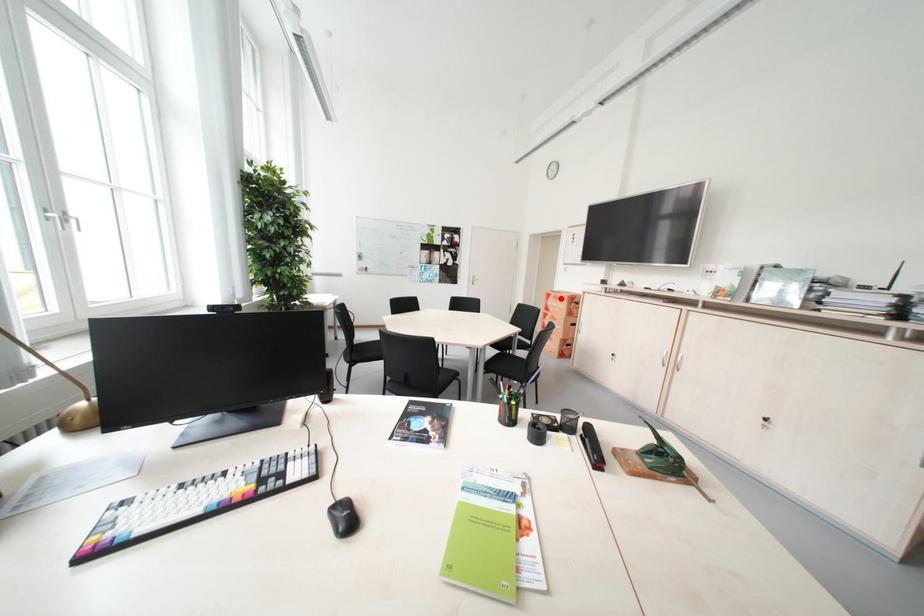
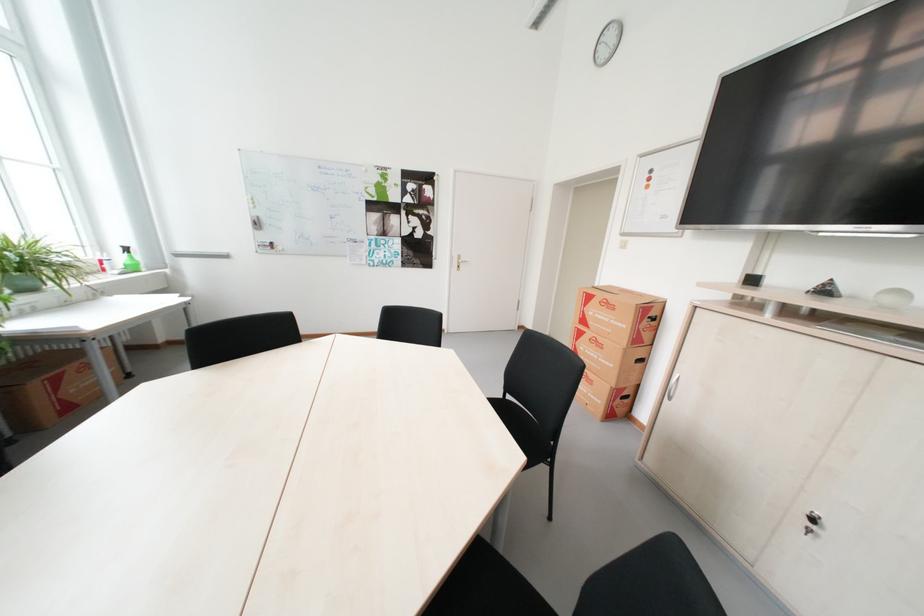
Question: I am providing you with two images of the same scene from different viewpoints. Image1 has a red point marked. In image2, the corresponding 3D location appears at what relative position? Reply with the corresponding letter.

Choices:
 (A) Closer
 (B) Farther

Answer: (B)